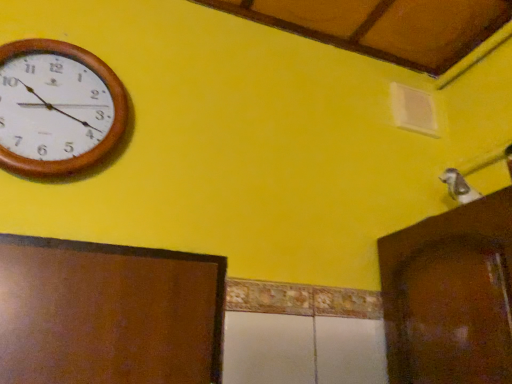
In order to face wooden clock at upper left, should I rotate leftwards or rightwards?

Turn left by 26.368 degrees to look at wooden clock at upper left.

At what (x,y) coordinates should I click in order to perform the action: click on wooden clock at upper left. Please return your answer as a coordinate pair (x, y). Image resolution: width=512 pixels, height=384 pixels. Looking at the image, I should click on (58, 110).

What do you see at coordinates (58, 110) in the screenshot? The height and width of the screenshot is (384, 512). I see `wooden clock at upper left` at bounding box center [58, 110].

The image size is (512, 384). Find the location of `wooden clock at upper left`. wooden clock at upper left is located at coordinates (58, 110).